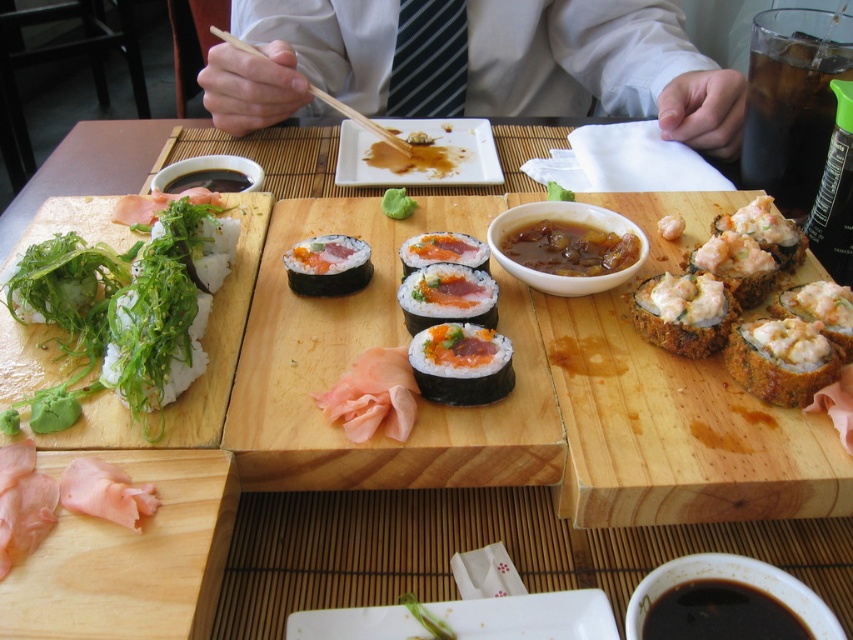
You are a customer at the sushi restaurant and want to reach the point labeled as point [99,509] first. Which direction should you move from point [659,234] to get there?

To reach point [99,509] from point [659,234], you should move forward since point [99,509] is in front of point [659,234].

You are a customer at the restaurant and want to pick up the sushi piece located at point (598, 250). However, there is another sushi piece at point (485, 257) blocking your view. Can you reach the first piece without moving the second one?

Point (598, 250) is behind point (485, 257), so you cannot reach the first piece without moving the second one.

Looking at the sushi platter, which item is taller between the brown glossy sauce at center and the shiny pink salmon at center?

The brown glossy sauce at center is taller than the shiny pink salmon at center.